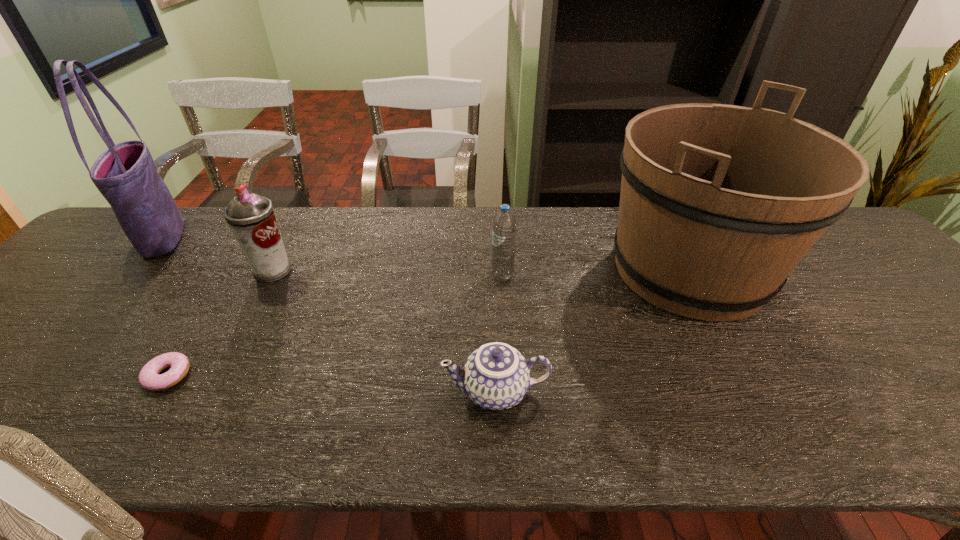
The image size is (960, 540). I want to click on vacant area located 0.370m on the left of the aerosol can, so tap(114, 271).

Identify the location of free space located on the front of the third shortest object. The image size is (960, 540). (504, 310).

Find the location of a particular element. This screenshot has width=960, height=540. vacant space situated 0.060m from the spout of the chinaware is located at coordinates pyautogui.click(x=414, y=391).

The width and height of the screenshot is (960, 540). In order to click on free space located 0.110m from the spout of the chinaware in this screenshot , I will do `click(389, 391)`.

Locate an element on the screen. vacant space situated 0.320m from the spout of the chinaware is located at coordinates (286, 391).

In order to click on free space located on the right of the doughnut in this screenshot , I will do `click(284, 375)`.

The width and height of the screenshot is (960, 540). I want to click on tote bag situated at the far edge, so click(x=125, y=174).

You are a GUI agent. You are given a task and a screenshot of the screen. Output one action in this format:
    pyautogui.click(x=<x>, y=<y>)
    Task: Click on the bucket present at the far edge
    Image resolution: width=960 pixels, height=540 pixels.
    Given the screenshot: What is the action you would take?
    pyautogui.click(x=719, y=203)

This screenshot has height=540, width=960. Find the location of `object that is at the near edge`. object that is at the near edge is located at coordinates (496, 376).

You are a GUI agent. You are given a task and a screenshot of the screen. Output one action in this format:
    pyautogui.click(x=<x>, y=<y>)
    Task: Click on the object that is positioned at the left edge
    The image size is (960, 540).
    Given the screenshot: What is the action you would take?
    pyautogui.click(x=125, y=174)